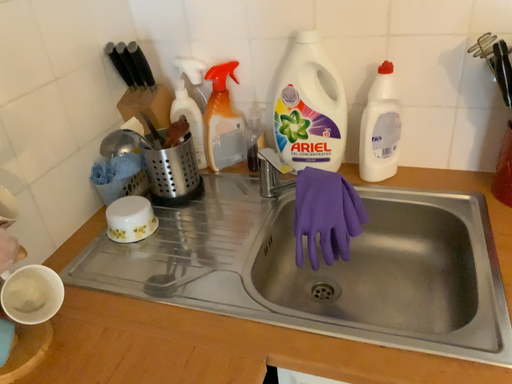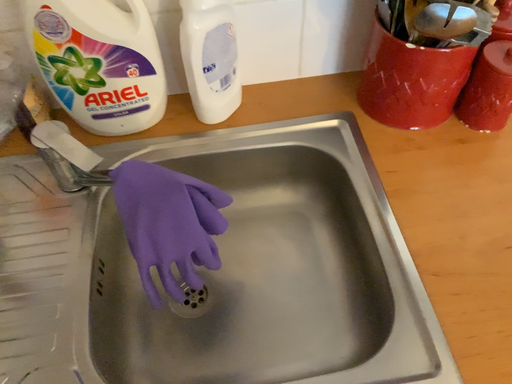
Question: How did the camera likely rotate when shooting the video?

Choices:
 (A) rotated left
 (B) rotated right

Answer: (B)